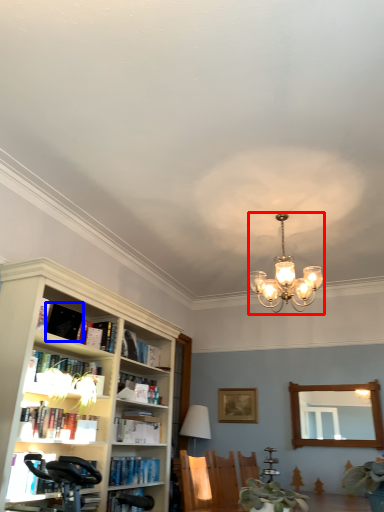
Question: Which point is closer to the camera, lamp (highlighted by a red box) or book (highlighted by a blue box)?

Choices:
 (A) lamp
 (B) book

Answer: (A)